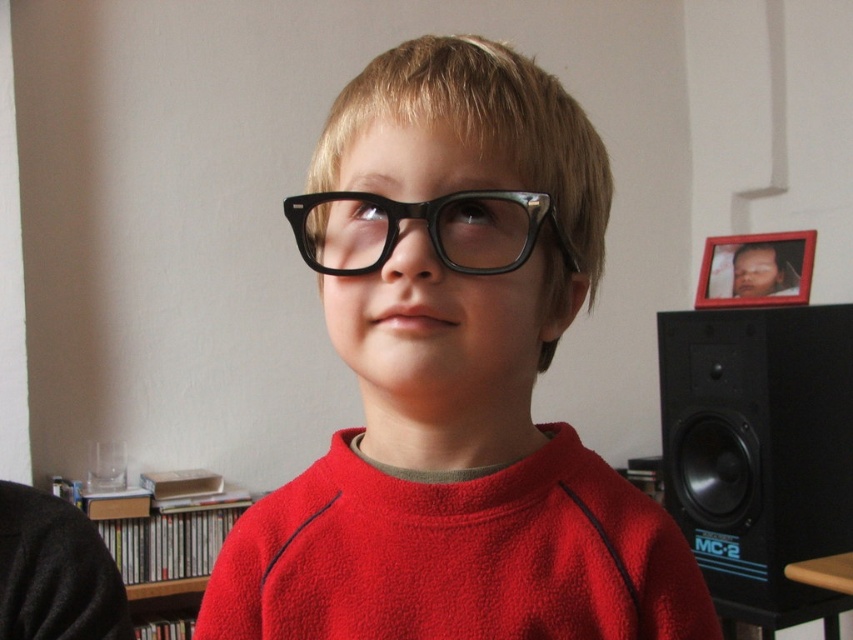
Which is more to the left, black plastic speaker at right or wooden bookshelf at lower left?

Positioned to the left is wooden bookshelf at lower left.

Does point (682, 340) come behind point (126, 570)?

Yes, it is.

Which is in front, point (795, 449) or point (80, 506)?

Point (795, 449) is in front.

The height and width of the screenshot is (640, 853). In order to click on black plastic speaker at right in this screenshot , I will do `click(758, 449)`.

Who is positioned more to the right, matte black glasses at center or black acetate glasses at center?

matte black glasses at center is more to the right.

Does matte black glasses at center appear under black acetate glasses at center?

Yes, matte black glasses at center is below black acetate glasses at center.

Identify the location of matte black glasses at center. (454, 381).

Which is in front, point (331, 269) or point (184, 589)?

Point (331, 269)

What do you see at coordinates (426, 228) in the screenshot?
I see `black acetate glasses at center` at bounding box center [426, 228].

Where is `black acetate glasses at center`? black acetate glasses at center is located at coordinates (426, 228).